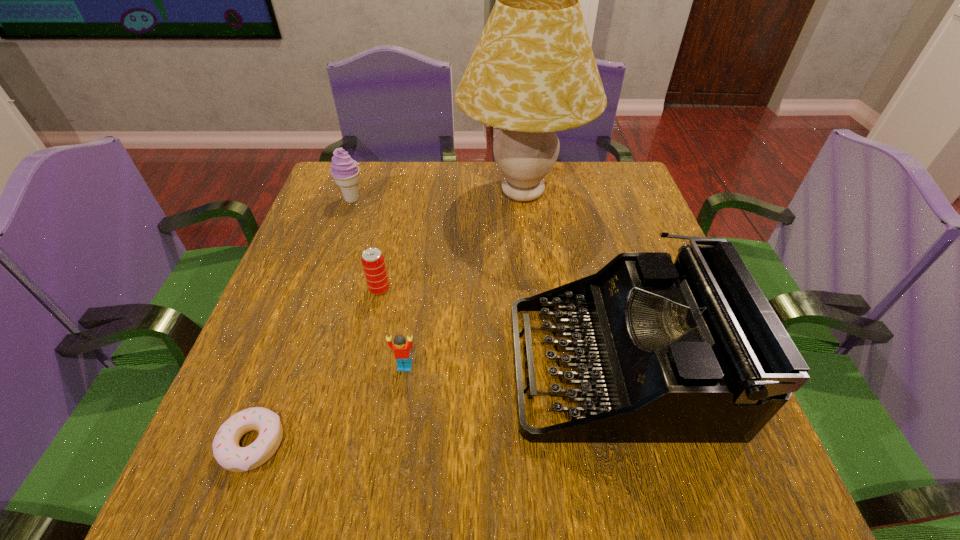
Image resolution: width=960 pixels, height=540 pixels. What are the coordinates of `empty space between the lampshade and the typewriter` in the screenshot? It's located at pos(569,279).

What are the coordinates of `free space between the typewriter and the doughnut` in the screenshot? It's located at (435, 404).

Where is `object that is the third closest to the doughnut`? The height and width of the screenshot is (540, 960). object that is the third closest to the doughnut is located at coordinates (687, 352).

Choose which object is the third nearest neighbor to the fourth nearest object. Please provide its 2D coordinates. Your answer should be formatted as a tuple, i.e. [(x, y)], where the tuple contains the x and y coordinates of a point satisfying the conditions above.

[(687, 352)]

Where is `free space in the image that satisfies the following two spatial constraints: 1. on the typing side of the typewriter; 2. on the front side of the shortest object`? This screenshot has height=540, width=960. free space in the image that satisfies the following two spatial constraints: 1. on the typing side of the typewriter; 2. on the front side of the shortest object is located at coordinates (637, 444).

This screenshot has width=960, height=540. Find the location of `vacant region that satisfies the following two spatial constraints: 1. on the back side of the shortest object; 2. on the right side of the third object from left to right`. vacant region that satisfies the following two spatial constraints: 1. on the back side of the shortest object; 2. on the right side of the third object from left to right is located at coordinates (310, 289).